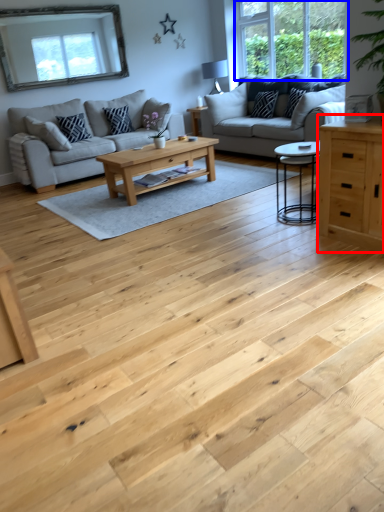
Question: Which of the following is the farthest to the observer, chest of drawers (highlighted by a red box) or window (highlighted by a blue box)?

Choices:
 (A) chest of drawers
 (B) window

Answer: (B)